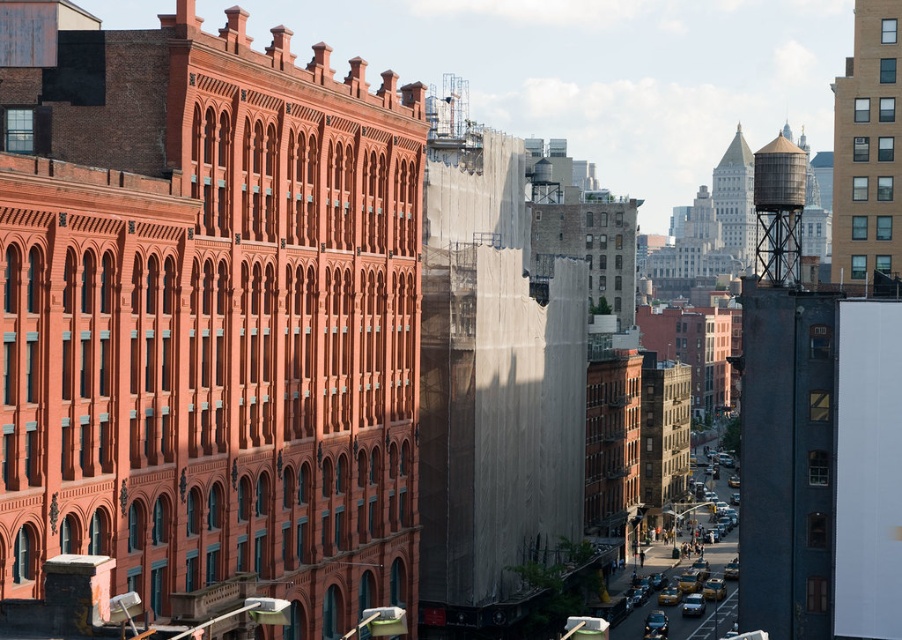
Question: Is rustic metal water tower at upper right smaller than shiny black sedan at center?

Choices:
 (A) no
 (B) yes

Answer: (A)

Question: Which point is closer to the camera?

Choices:
 (A) rustic metal water tower at upper right
 (B) metallic gray water tower at right
 (C) shiny black sedan at center

Answer: (B)

Question: Considering the relative positions of metallic gray water tower at right and yellow matte taxi cab at center in the image provided, where is metallic gray water tower at right located with respect to yellow matte taxi cab at center?

Choices:
 (A) above
 (B) below

Answer: (A)

Question: Observing the image, what is the correct spatial positioning of rustic metal water tower at upper right in reference to yellow matte taxi cab at center?

Choices:
 (A) above
 (B) below

Answer: (A)

Question: Which point is closer to the camera taking this photo?

Choices:
 (A) (628, 632)
 (B) (790, 515)
 (C) (683, 611)
 (D) (785, 262)

Answer: (B)

Question: Which object appears farthest from the camera in this image?

Choices:
 (A) yellow matte taxi cab at center
 (B) metallic gray water tower at right

Answer: (A)